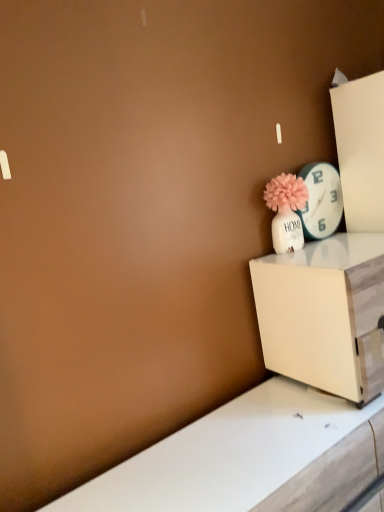
Question: Does matte white vase with pink flower at upper right lie behind white glossy clock at upper right?

Choices:
 (A) yes
 (B) no

Answer: (B)

Question: Can you confirm if matte white vase with pink flower at upper right is positioned to the left of white glossy clock at upper right?

Choices:
 (A) yes
 (B) no

Answer: (A)

Question: From a real-world perspective, is matte white vase with pink flower at upper right under white glossy clock at upper right?

Choices:
 (A) yes
 (B) no

Answer: (A)

Question: Does matte white vase with pink flower at upper right have a greater height compared to white glossy clock at upper right?

Choices:
 (A) no
 (B) yes

Answer: (A)

Question: Is matte white vase with pink flower at upper right in front of white glossy clock at upper right?

Choices:
 (A) yes
 (B) no

Answer: (A)

Question: Is matte white vase with pink flower at upper right smaller than white glossy clock at upper right?

Choices:
 (A) no
 (B) yes

Answer: (A)

Question: Would you say white wood nightstand at lower right is a long distance from matte white vase with pink flower at upper right?

Choices:
 (A) no
 (B) yes

Answer: (A)

Question: Does white wood nightstand at lower right touch matte white vase with pink flower at upper right?

Choices:
 (A) yes
 (B) no

Answer: (B)

Question: From the image's perspective, would you say white wood nightstand at lower right is positioned over matte white vase with pink flower at upper right?

Choices:
 (A) no
 (B) yes

Answer: (A)

Question: Is white wood nightstand at lower right positioned in front of matte white vase with pink flower at upper right?

Choices:
 (A) no
 (B) yes

Answer: (B)

Question: Does white wood nightstand at lower right have a larger size compared to matte white vase with pink flower at upper right?

Choices:
 (A) no
 (B) yes

Answer: (B)

Question: Is white wood nightstand at lower right thinner than matte white vase with pink flower at upper right?

Choices:
 (A) yes
 (B) no

Answer: (B)

Question: Considering the relative positions of white glossy clock at upper right and matte white vase with pink flower at upper right in the image provided, is white glossy clock at upper right in front of matte white vase with pink flower at upper right?

Choices:
 (A) yes
 (B) no

Answer: (B)